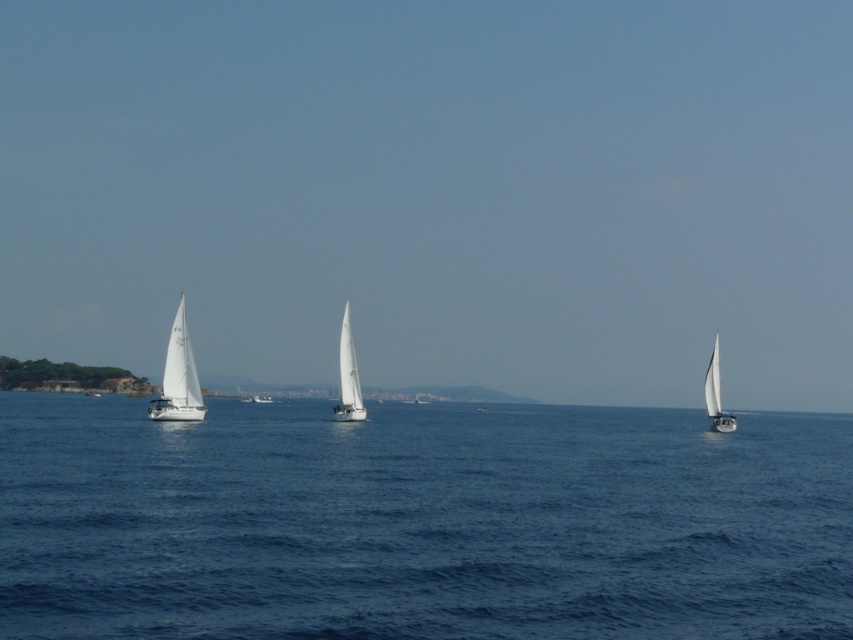
Question: Is blue water at center in front of white matte sailboat at center?

Choices:
 (A) yes
 (B) no

Answer: (A)

Question: Where is white matte sailboat at center located in relation to white matte sailboat at right in the image?

Choices:
 (A) below
 (B) above

Answer: (B)

Question: Can you confirm if blue water at center is positioned to the left of white matte sailboat at right?

Choices:
 (A) no
 (B) yes

Answer: (B)

Question: Which object appears closest to the camera in this image?

Choices:
 (A) blue water at center
 (B) white matte sailboat at left
 (C) white matte sailboat at right
 (D) white matte sailboat at center

Answer: (A)

Question: Which point is closer to the camera taking this photo?

Choices:
 (A) (712, 394)
 (B) (242, 628)
 (C) (196, 404)

Answer: (B)

Question: Which point appears closest to the camera in this image?

Choices:
 (A) (706, 369)
 (B) (194, 372)

Answer: (B)